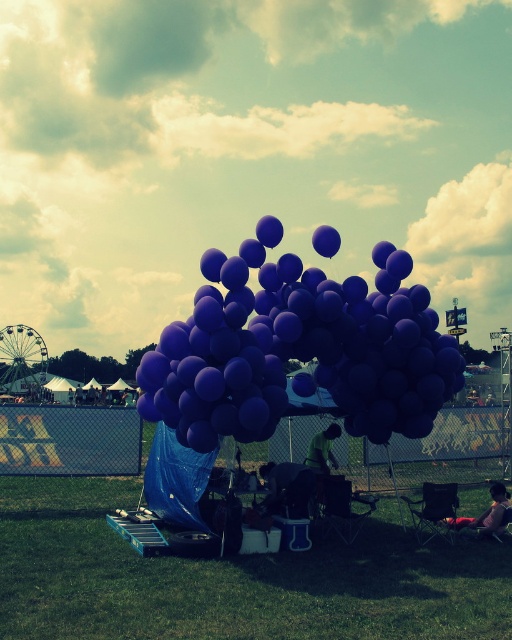
Question: Which is farther from the green grass at lower center?

Choices:
 (A) green fabric at center
 (B) matte purple balloons at center

Answer: (B)

Question: Does matte purple balloons at center lie behind green fabric at center?

Choices:
 (A) no
 (B) yes

Answer: (A)

Question: Which is farther from the matte pink shirt at lower right?

Choices:
 (A) matte purple balloons at center
 (B) green fabric at center

Answer: (A)

Question: Is matte purple balloons at center wider than green fabric at center?

Choices:
 (A) no
 (B) yes

Answer: (A)

Question: Does matte pink shirt at lower right come behind green fabric at center?

Choices:
 (A) yes
 (B) no

Answer: (B)

Question: Which point is farther from the camera taking this photo?

Choices:
 (A) (387, 275)
 (B) (442, 520)
 (C) (16, 540)

Answer: (B)